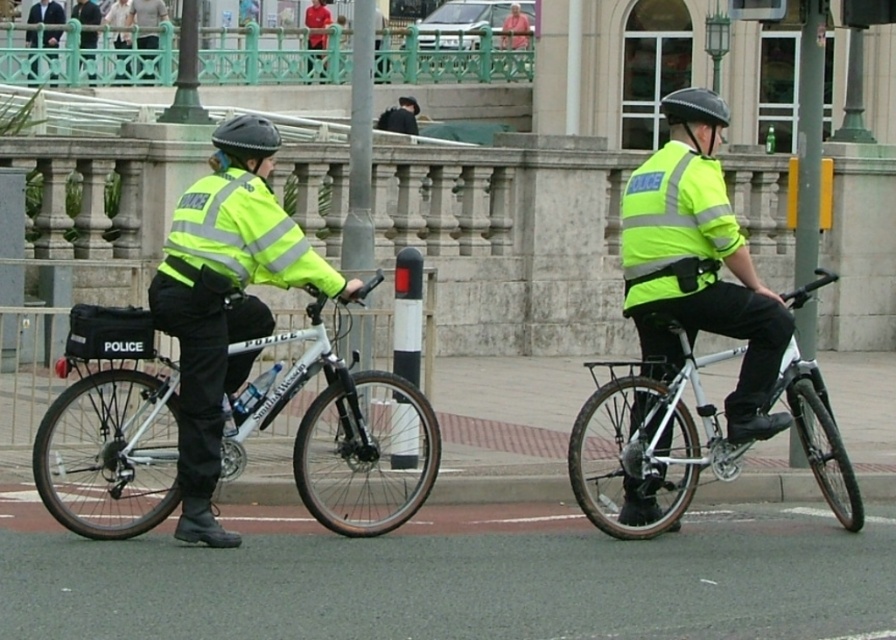
You are a pedestrian trying to cross the street and see the high visibility yellow reflective vest at center. Based on its position, can you estimate if it is on the left or right officer?

The high visibility yellow reflective vest at center is located at point (698,262), which is at the center of the image. Since both officers are positioned on either side of the image, the vest is likely centered between them, making it impossible to determine which officer it belongs to based on position alone.

You are a photographer standing at the camera position taking a photo of the two police officers on bicycles. You want to focus on the point closer to you. Which point should you choose between point (210, 365) and point (623, 465)?

You should choose point (210, 365) because it is closer to the camera than point (623, 465).